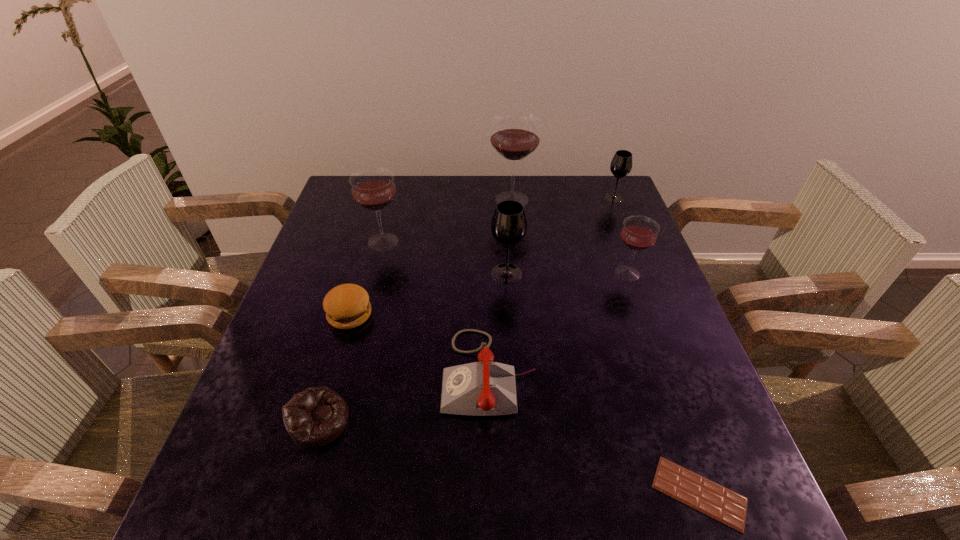
What are the coordinates of `free region located on the left of the farther gray wineglass` in the screenshot? It's located at (582, 198).

Where is `free region located on the dial of the telephone`? free region located on the dial of the telephone is located at coordinates (400, 373).

The height and width of the screenshot is (540, 960). Find the location of `free location located on the dial of the telephone`. free location located on the dial of the telephone is located at coordinates (367, 373).

The height and width of the screenshot is (540, 960). I want to click on free space located 0.070m on the dial of the telephone, so click(410, 373).

Locate an element on the screen. free space located 0.380m on the back of the hamburger is located at coordinates click(380, 210).

Identify the location of vacant space situated on the back of the brown beanbag. (357, 289).

Find the location of a particular element. free space located 0.250m on the back of the chocolate bar is located at coordinates (648, 346).

The image size is (960, 540). What are the coordinates of `object present at the near edge` in the screenshot? It's located at (718, 502).

The height and width of the screenshot is (540, 960). Find the location of `wineglass that is positioned at the left edge`. wineglass that is positioned at the left edge is located at coordinates (372, 188).

I want to click on hamburger located in the left edge section of the desktop, so click(x=347, y=306).